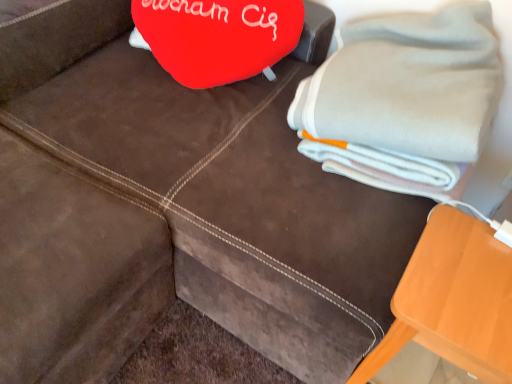
The image size is (512, 384). What are the coordinates of `orange wood table at lower right` in the screenshot? It's located at (383, 352).

Image resolution: width=512 pixels, height=384 pixels. Describe the element at coordinates (383, 352) in the screenshot. I see `orange wood table at lower right` at that location.

In order to face orange wood table at lower right, should I rotate leftwards or rightwards?

You should rotate right by 24.147 degrees.

Measure the distance between point (426, 85) and camera.

Point (426, 85) is 91.70 centimeters away from camera.

Locate an element on the screen. gray cotton bath towel at upper right is located at coordinates (409, 84).

Describe the element at coordinates (409, 84) in the screenshot. The image size is (512, 384). I see `gray cotton bath towel at upper right` at that location.

This screenshot has height=384, width=512. I want to click on orange wood table at lower right, so click(x=383, y=352).

Can you confirm if gray cotton bath towel at upper right is positioned to the left of orange wood table at lower right?

Correct, you'll find gray cotton bath towel at upper right to the left of orange wood table at lower right.

Who is more distant, gray cotton bath towel at upper right or orange wood table at lower right?

gray cotton bath towel at upper right is further away from the camera.

Which is in front, point (390, 119) or point (405, 273)?

The point (405, 273) is more forward.

From the image's perspective, is gray cotton bath towel at upper right over orange wood table at lower right?

Yes, from the image's perspective, gray cotton bath towel at upper right is on top of orange wood table at lower right.

From a real-world perspective, is gray cotton bath towel at upper right positioned above or below orange wood table at lower right?

In terms of real-world spatial position, gray cotton bath towel at upper right is above orange wood table at lower right.

Which of these two, gray cotton bath towel at upper right or orange wood table at lower right, is wider?

gray cotton bath towel at upper right is wider.

Can you confirm if gray cotton bath towel at upper right is taller than orange wood table at lower right?

Incorrect, the height of gray cotton bath towel at upper right is not larger of that of orange wood table at lower right.

Considering the relative sizes of gray cotton bath towel at upper right and orange wood table at lower right in the image provided, is gray cotton bath towel at upper right smaller than orange wood table at lower right?

Incorrect, gray cotton bath towel at upper right is not smaller in size than orange wood table at lower right.

Is gray cotton bath towel at upper right positioned beyond the bounds of orange wood table at lower right?

Yes.

Is gray cotton bath towel at upper right next to orange wood table at lower right and touching it?

No, gray cotton bath towel at upper right is not in contact with orange wood table at lower right.

Is gray cotton bath towel at upper right oriented towards orange wood table at lower right?

No, gray cotton bath towel at upper right is not facing towards orange wood table at lower right.

Looking at this image, how much distance is there between gray cotton bath towel at upper right and orange wood table at lower right?

12.92 inches.

At what (x,y) coordinates should I click in order to perform the action: click on furniture in front of the gray cotton bath towel at upper right. Please return your answer as a coordinate pair (x, y). The width and height of the screenshot is (512, 384). Looking at the image, I should click on (383, 352).

Is orange wood table at lower right to the left or to the right of gray cotton bath towel at upper right in the image?

Based on their positions, orange wood table at lower right is located to the right of gray cotton bath towel at upper right.

Which is behind, orange wood table at lower right or gray cotton bath towel at upper right?

gray cotton bath towel at upper right is further away from the camera.

Is point (385, 339) positioned before point (328, 79)?

Yes, it is in front of point (328, 79).

From the picture: From the image's perspective, does orange wood table at lower right appear higher than gray cotton bath towel at upper right?

No, from the image's perspective, orange wood table at lower right is not over gray cotton bath towel at upper right.

From a real-world perspective, is orange wood table at lower right above or below gray cotton bath towel at upper right?

orange wood table at lower right is below gray cotton bath towel at upper right.

Which of these two, orange wood table at lower right or gray cotton bath towel at upper right, is thinner?

orange wood table at lower right is thinner.

Considering the sizes of objects orange wood table at lower right and gray cotton bath towel at upper right in the image provided, who is shorter, orange wood table at lower right or gray cotton bath towel at upper right?

gray cotton bath towel at upper right.

Can you confirm if orange wood table at lower right is smaller than gray cotton bath towel at upper right?

Correct, orange wood table at lower right occupies less space than gray cotton bath towel at upper right.

Is orange wood table at lower right outside of gray cotton bath towel at upper right?

Indeed, orange wood table at lower right is completely outside gray cotton bath towel at upper right.

Is orange wood table at lower right directly adjacent to gray cotton bath towel at upper right?

orange wood table at lower right and gray cotton bath towel at upper right are clearly separated.

Could you tell me if orange wood table at lower right is facing gray cotton bath towel at upper right?

No, orange wood table at lower right is not aimed at gray cotton bath towel at upper right.

Can you tell me how much orange wood table at lower right and gray cotton bath towel at upper right differ in facing direction?

orange wood table at lower right and gray cotton bath towel at upper right are facing 1.16 degrees away from each other.

Measure the distance from orange wood table at lower right to gray cotton bath towel at upper right.

orange wood table at lower right is 12.92 inches from gray cotton bath towel at upper right.

Identify the location of bath towel on the left of orange wood table at lower right. (409, 84).

Identify the location of furniture located underneath the gray cotton bath towel at upper right (from a real-world perspective). This screenshot has width=512, height=384. (383, 352).

Where is `furniture below the gray cotton bath towel at upper right (from the image's perspective)`? furniture below the gray cotton bath towel at upper right (from the image's perspective) is located at coordinates (383, 352).